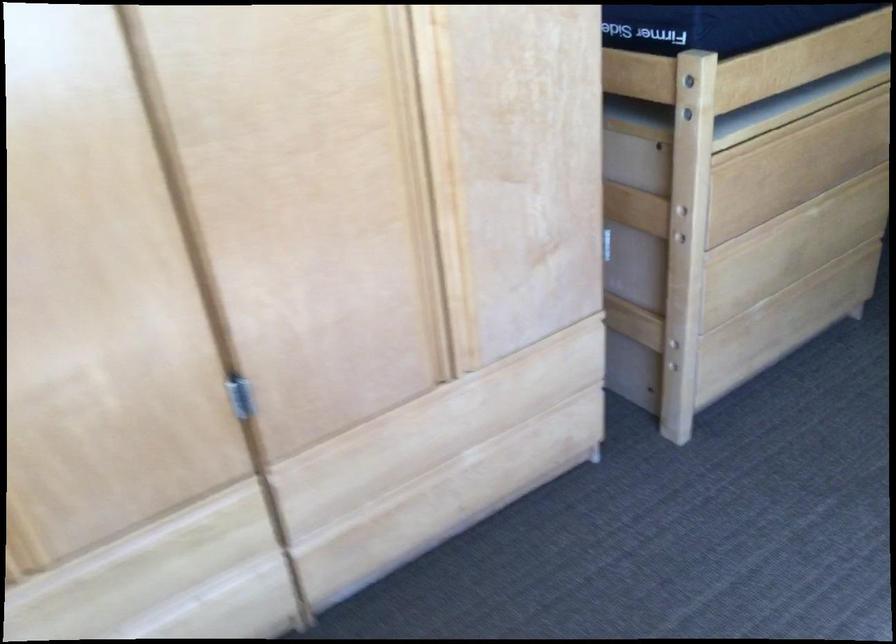
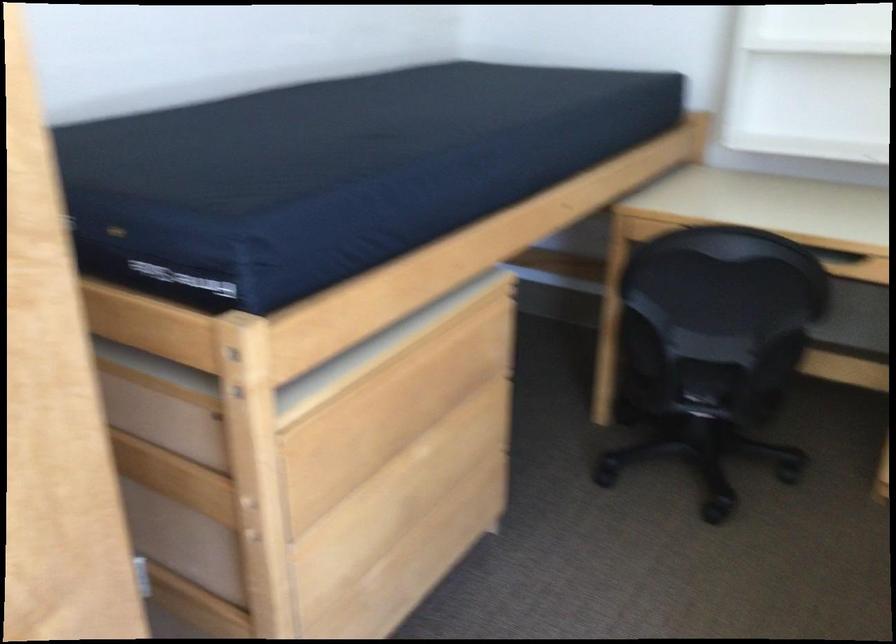
Where in the second image is the point corresponding to the point at 802,223 from the first image?

(419, 473)